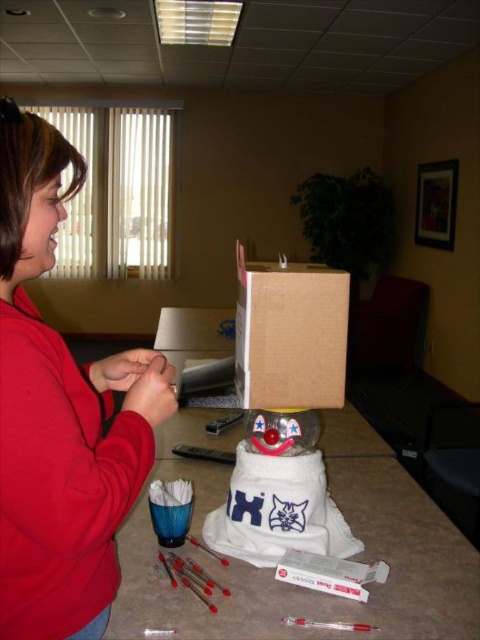
You are a delivery person who just arrived at an office and need to place a package on the translucent plastic table at center. The package is 36 inches long. Can you fit the package on the table without it hanging off the edge? Please explain your reasoning.

The translucent plastic table at center is 37.34 inches away from the viewer. The distance from the viewer does not indicate the table size. Without knowing the table dimensions, it is impossible to determine if the package will fit. Additional information about the table length is needed.

You are organizing a winter clothing drive and need to decide which items to pack first. You have a red fleece sweatshirt at left and a translucent plastic snowman at center. Based on their sizes, which item should you pack first?

The red fleece sweatshirt at left is larger in size than the translucent plastic snowman at center, so you should pack the red fleece sweatshirt at left first because it takes up more space and needs to be packed first to optimize the packing space.

You are organizing a winter clothing drive and need to determine which item takes up more space between the red fleece sweatshirt at left and the translucent plastic snowman at center. Which item should you allocate more storage space for?

The translucent plastic snowman at center is thicker than the red fleece sweatshirt at left, so you should allocate more storage space for the translucent plastic snowman at center.